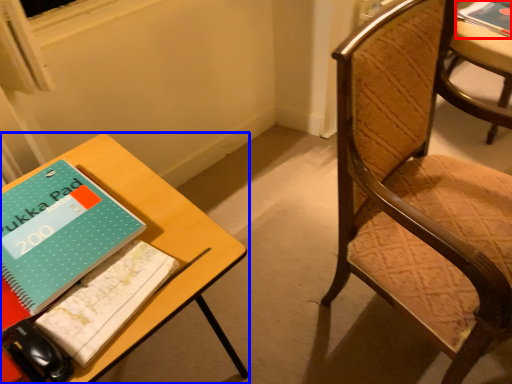
Question: Which point is closer to the camera, book (highlighted by a red box) or table (highlighted by a blue box)?

Choices:
 (A) book
 (B) table

Answer: (B)